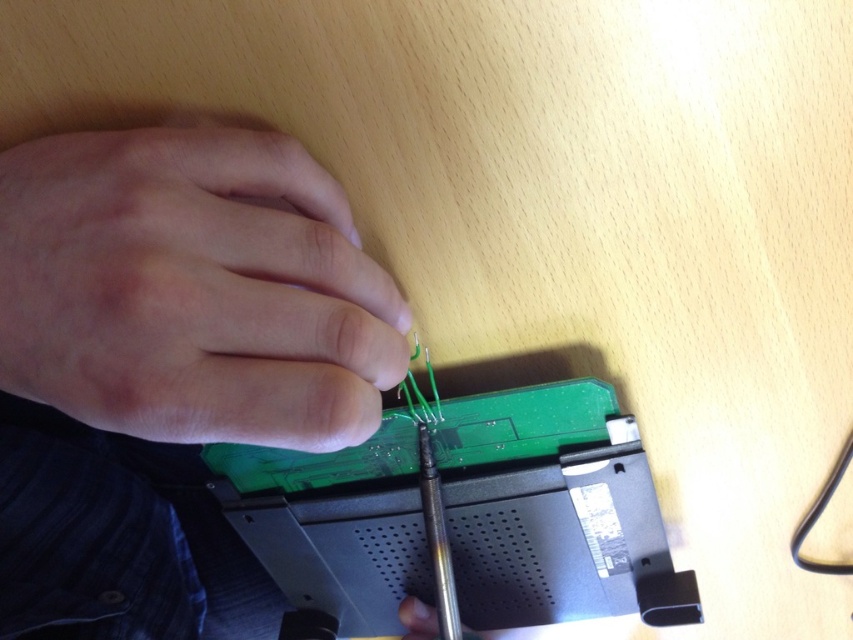
Question: From the image, what is the correct spatial relationship of skinny white hand at upper left in relation to matte black hand at center?

Choices:
 (A) right
 (B) left

Answer: (B)

Question: Among these objects, which one is nearest to the camera?

Choices:
 (A) skinny white hand at upper left
 (B) matte black hand at center

Answer: (A)

Question: Does skinny white hand at upper left appear over matte black hand at center?

Choices:
 (A) no
 (B) yes

Answer: (B)

Question: Which point is closer to the camera?

Choices:
 (A) (222, 365)
 (B) (424, 614)

Answer: (A)

Question: Which point appears farthest from the camera in this image?

Choices:
 (A) (410, 621)
 (B) (25, 211)

Answer: (A)

Question: Can you confirm if skinny white hand at upper left is bigger than matte black hand at center?

Choices:
 (A) yes
 (B) no

Answer: (A)